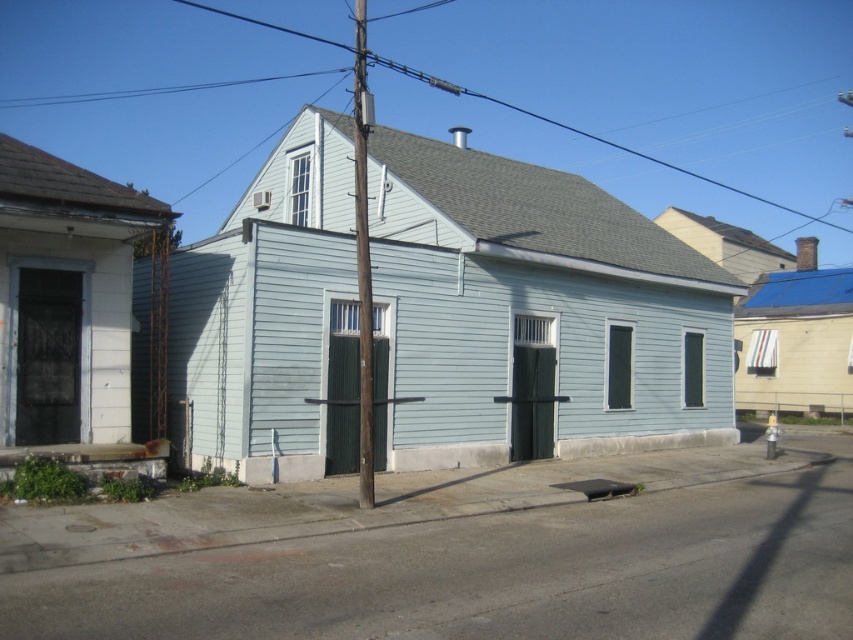
Question: Does brown wooden telegraph pole at center lie behind gray wire at upper center?

Choices:
 (A) no
 (B) yes

Answer: (A)

Question: Which of the following is the farthest from the observer?

Choices:
 (A) (363, 404)
 (B) (515, 108)

Answer: (B)

Question: Does brown wooden telegraph pole at center appear over gray wire at upper center?

Choices:
 (A) yes
 (B) no

Answer: (B)

Question: Does brown wooden telegraph pole at center have a lesser width compared to gray wire at upper center?

Choices:
 (A) yes
 (B) no

Answer: (A)

Question: Which point appears farthest from the camera in this image?

Choices:
 (A) (573, 129)
 (B) (369, 419)

Answer: (A)